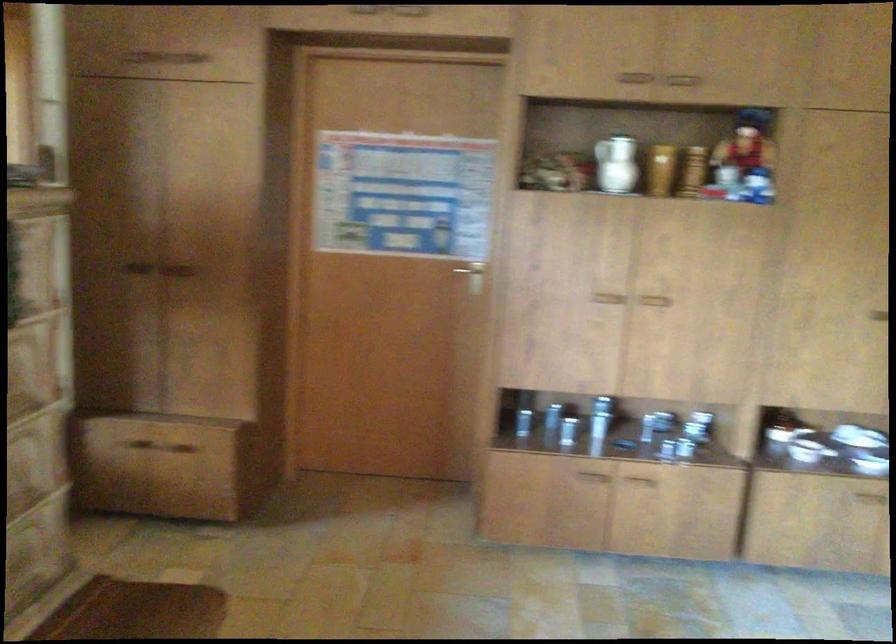
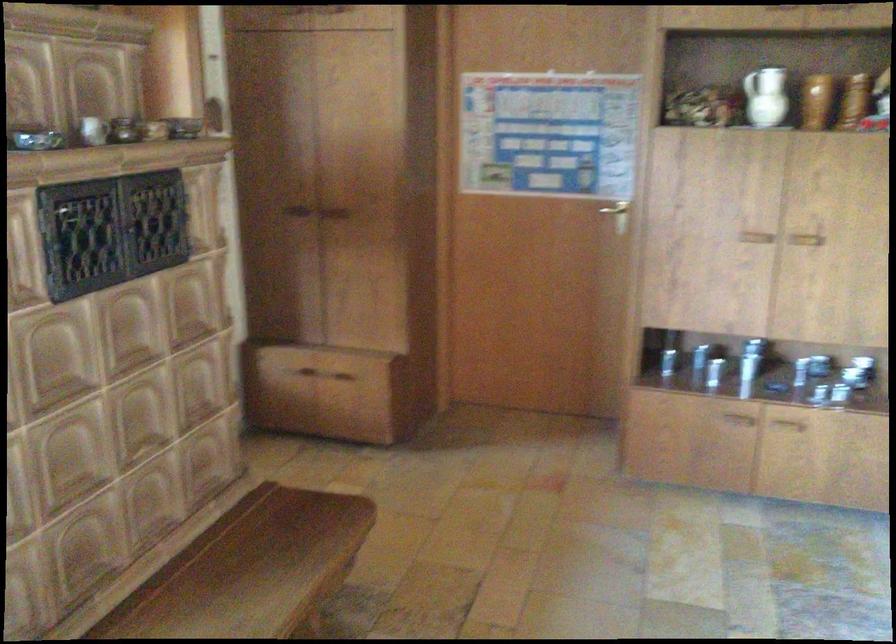
Question: The camera is either moving clockwise (left) or counter-clockwise (right) around the object. The first image is from the beginning of the video and the second image is from the end. Is the camera moving left or right when shooting the video?

Choices:
 (A) Left
 (B) Right

Answer: (B)